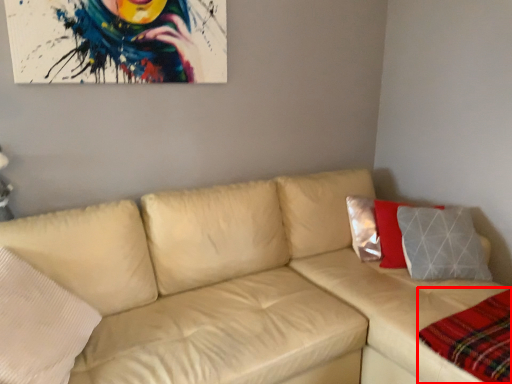
Question: In this image, where is plaid (annotated by the red box) located relative to studio couch?

Choices:
 (A) left
 (B) right

Answer: (B)